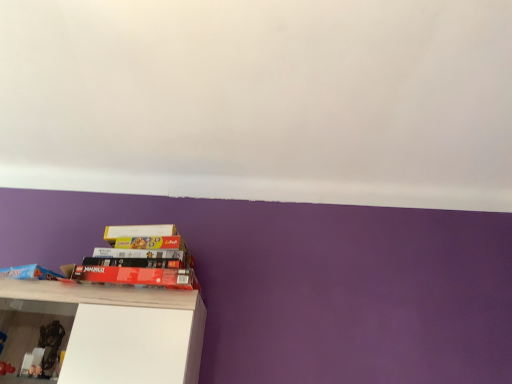
What is the approximate height of matte black book at lower left, which is counted as the first book, starting from the right?

It is 2.05 inches.

This screenshot has height=384, width=512. What are the coordinates of `white glossy shelf at lower left` in the screenshot? It's located at (105, 331).

What do you see at coordinates (36, 273) in the screenshot? Image resolution: width=512 pixels, height=384 pixels. I see `matte blue book at lower left, the second book in the right-to-left sequence` at bounding box center [36, 273].

Locate an element on the screen. matte black book at lower left, acting as the 2th book starting from the left is located at coordinates (137, 276).

Who is taller, matte black book at lower left, which is counted as the first book, starting from the right, or white glossy shelf at lower left?

Standing taller between the two is white glossy shelf at lower left.

Considering the sizes of objects matte black book at lower left, acting as the 2th book starting from the left, and white glossy shelf at lower left in the image provided, who is thinner, matte black book at lower left, acting as the 2th book starting from the left, or white glossy shelf at lower left?

With smaller width is matte black book at lower left, acting as the 2th book starting from the left.

Considering the relative sizes of matte blue book at lower left, the second book in the right-to-left sequence, and matte black book at lower left, acting as the 2th book starting from the left, in the image provided, is matte blue book at lower left, the second book in the right-to-left sequence, wider than matte black book at lower left, acting as the 2th book starting from the left,?

No.

Which object is further away from the camera, matte blue book at lower left, which ranks as the first book in left-to-right order, or matte black book at lower left, which is counted as the first book, starting from the right?

matte black book at lower left, which is counted as the first book, starting from the right, is further away from the camera.

Considering the relative sizes of matte blue book at lower left, the second book in the right-to-left sequence, and matte black book at lower left, which is counted as the first book, starting from the right, in the image provided, is matte blue book at lower left, the second book in the right-to-left sequence, bigger than matte black book at lower left, which is counted as the first book, starting from the right,?

No.

Would you say matte black book at lower left, acting as the 2th book starting from the left, is part of matte blue book at lower left, which ranks as the first book in left-to-right order,'s contents?

No, matte blue book at lower left, which ranks as the first book in left-to-right order, does not contain matte black book at lower left, acting as the 2th book starting from the left.

Considering the relative sizes of white glossy shelf at lower left and matte blue book at lower left, the second book in the right-to-left sequence, in the image provided, is white glossy shelf at lower left shorter than matte blue book at lower left, the second book in the right-to-left sequence,?

Incorrect, the height of white glossy shelf at lower left does not fall short of that of matte blue book at lower left, the second book in the right-to-left sequence.

How much distance is there between white glossy shelf at lower left and matte blue book at lower left, which ranks as the first book in left-to-right order?

white glossy shelf at lower left and matte blue book at lower left, which ranks as the first book in left-to-right order, are 10.70 inches apart.

Is there a large distance between white glossy shelf at lower left and matte blue book at lower left, the second book in the right-to-left sequence?

No, white glossy shelf at lower left is not far away from matte blue book at lower left, the second book in the right-to-left sequence.

Do you think white glossy shelf at lower left is within matte blue book at lower left, which ranks as the first book in left-to-right order, or outside of it?

white glossy shelf at lower left is spatially situated outside matte blue book at lower left, which ranks as the first book in left-to-right order.

Which is more to the left, white glossy shelf at lower left or matte black book at lower left, acting as the 2th book starting from the left?

Positioned to the left is white glossy shelf at lower left.

Is white glossy shelf at lower left not within matte black book at lower left, acting as the 2th book starting from the left?

Absolutely, white glossy shelf at lower left is external to matte black book at lower left, acting as the 2th book starting from the left.

Looking at their sizes, would you say white glossy shelf at lower left is wider or thinner than matte black book at lower left, acting as the 2th book starting from the left?

white glossy shelf at lower left is wider than matte black book at lower left, acting as the 2th book starting from the left.

Can you confirm if matte black book at lower left, acting as the 2th book starting from the left, is positioned to the right of matte blue book at lower left, the second book in the right-to-left sequence?

Yes, matte black book at lower left, acting as the 2th book starting from the left, is to the right of matte blue book at lower left, the second book in the right-to-left sequence.

Which object is closer to the camera, matte black book at lower left, acting as the 2th book starting from the left, or matte blue book at lower left, the second book in the right-to-left sequence?

Positioned in front is matte blue book at lower left, the second book in the right-to-left sequence.

Is matte black book at lower left, acting as the 2th book starting from the left, facing towards matte blue book at lower left, the second book in the right-to-left sequence?

No, matte black book at lower left, acting as the 2th book starting from the left, does not turn towards matte blue book at lower left, the second book in the right-to-left sequence.

I want to click on book on the left of the matte black book at lower left, acting as the 2th book starting from the left, so click(x=36, y=273).

Is matte blue book at lower left, which ranks as the first book in left-to-right order, behind white glossy shelf at lower left?

Yes, matte blue book at lower left, which ranks as the first book in left-to-right order, is behind white glossy shelf at lower left.

Between matte blue book at lower left, the second book in the right-to-left sequence, and white glossy shelf at lower left, which one has more height?

white glossy shelf at lower left.

Is matte blue book at lower left, which ranks as the first book in left-to-right order, not close to white glossy shelf at lower left?

No, matte blue book at lower left, which ranks as the first book in left-to-right order, is not far from white glossy shelf at lower left.

Locate an element on the screen. book lying on the right of white glossy shelf at lower left is located at coordinates (137, 276).

Where is `book located in front of the matte black book at lower left, which is counted as the first book, starting from the right`? book located in front of the matte black book at lower left, which is counted as the first book, starting from the right is located at coordinates (36, 273).

From the image, which object appears to be farther from matte black book at lower left, which is counted as the first book, starting from the right, matte blue book at lower left, the second book in the right-to-left sequence, or white glossy shelf at lower left?

Among the two, matte blue book at lower left, the second book in the right-to-left sequence, is located further to matte black book at lower left, which is counted as the first book, starting from the right.

Based on their spatial positions, is matte black book at lower left, which is counted as the first book, starting from the right, or matte blue book at lower left, which ranks as the first book in left-to-right order, closer to white glossy shelf at lower left?

matte black book at lower left, which is counted as the first book, starting from the right.

Which object lies further to the anchor point matte black book at lower left, which is counted as the first book, starting from the right, white glossy shelf at lower left or matte blue book at lower left, the second book in the right-to-left sequence?

Based on the image, matte blue book at lower left, the second book in the right-to-left sequence, appears to be further to matte black book at lower left, which is counted as the first book, starting from the right.

From the image, which object appears to be farther from matte blue book at lower left, the second book in the right-to-left sequence, matte black book at lower left, acting as the 2th book starting from the left, or white glossy shelf at lower left?

Based on the image, white glossy shelf at lower left appears to be further to matte blue book at lower left, the second book in the right-to-left sequence.

Looking at the image, which one is located closer to matte blue book at lower left, which ranks as the first book in left-to-right order, white glossy shelf at lower left or matte black book at lower left, acting as the 2th book starting from the left?

matte black book at lower left, acting as the 2th book starting from the left, is closer to matte blue book at lower left, which ranks as the first book in left-to-right order.

Which object lies further to the anchor point white glossy shelf at lower left, matte blue book at lower left, which ranks as the first book in left-to-right order, or matte black book at lower left, which is counted as the first book, starting from the right?

matte blue book at lower left, which ranks as the first book in left-to-right order, is further to white glossy shelf at lower left.

Find the location of `shelf between matte blue book at lower left, the second book in the right-to-left sequence, and matte black book at lower left, which is counted as the first book, starting from the right`. shelf between matte blue book at lower left, the second book in the right-to-left sequence, and matte black book at lower left, which is counted as the first book, starting from the right is located at coordinates (105, 331).